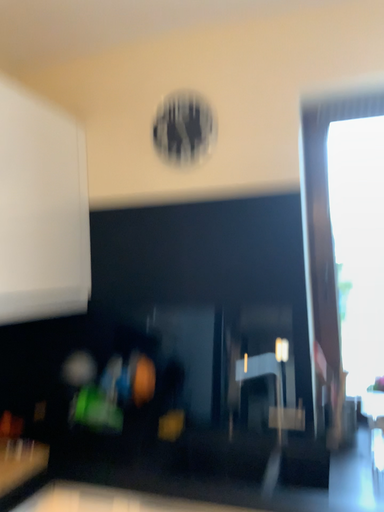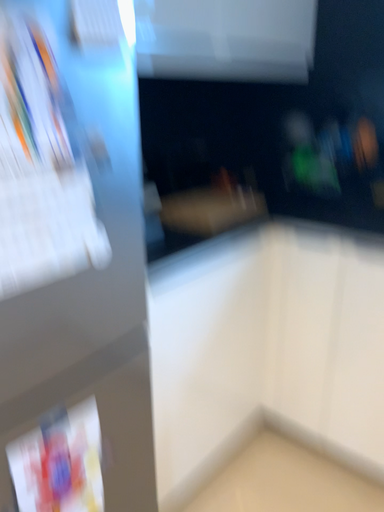
Question: Which way did the camera rotate in the video?

Choices:
 (A) rotated left
 (B) rotated right

Answer: (A)